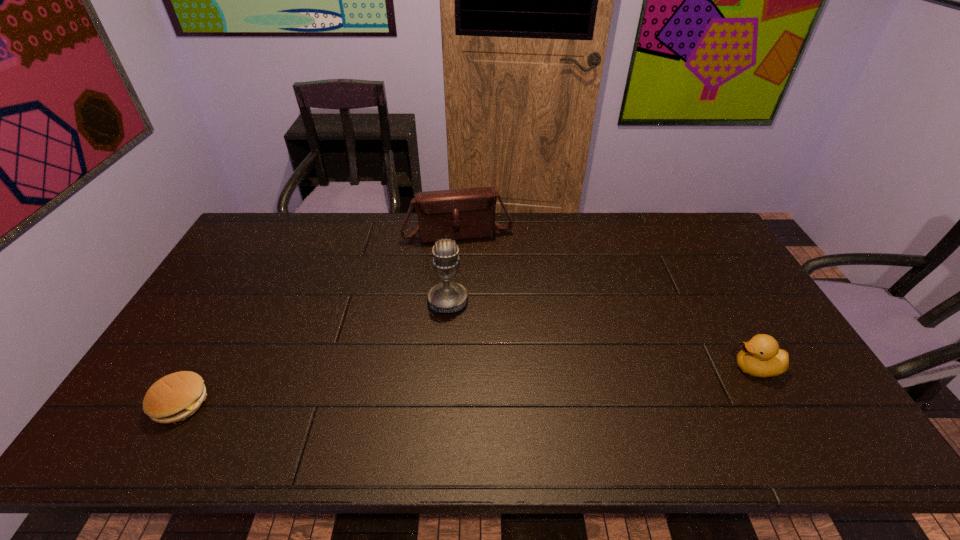
Image resolution: width=960 pixels, height=540 pixels. I want to click on vacant space positioned on the face of the second shortest object, so click(x=642, y=368).

I want to click on free space located 0.200m on the face of the second shortest object, so click(654, 368).

You are a GUI agent. You are given a task and a screenshot of the screen. Output one action in this format:
    pyautogui.click(x=<x>, y=<y>)
    Task: Click on the free space located 0.220m on the front flap of the farthest object
    
    Given the screenshot: What is the action you would take?
    pyautogui.click(x=477, y=288)

Identify the location of vacant space located on the front flap of the farthest object. Image resolution: width=960 pixels, height=540 pixels. (481, 303).

Image resolution: width=960 pixels, height=540 pixels. Identify the location of vacant space located 0.380m on the front flap of the farthest object. (487, 326).

Find the location of `vacant space located 0.300m on the front-facing side of the tallest object`. vacant space located 0.300m on the front-facing side of the tallest object is located at coordinates (446, 408).

You are a GUI agent. You are given a task and a screenshot of the screen. Output one action in this format:
    pyautogui.click(x=<x>, y=<y>)
    Task: Click on the vacant area situated 0.150m on the front-facing side of the tallest object
    The height and width of the screenshot is (540, 960).
    Given the screenshot: What is the action you would take?
    (447, 358)

The image size is (960, 540). What are the coordinates of `vacant space located 0.220m on the front-facing side of the tallest object` in the screenshot? It's located at (446, 380).

Locate an element on the screen. Image resolution: width=960 pixels, height=540 pixels. object present at the far edge is located at coordinates (459, 214).

You are a GUI agent. You are given a task and a screenshot of the screen. Output one action in this format:
    pyautogui.click(x=<x>, y=<y>)
    Task: Click on the patty situated at the near edge
    
    Given the screenshot: What is the action you would take?
    pyautogui.click(x=174, y=397)